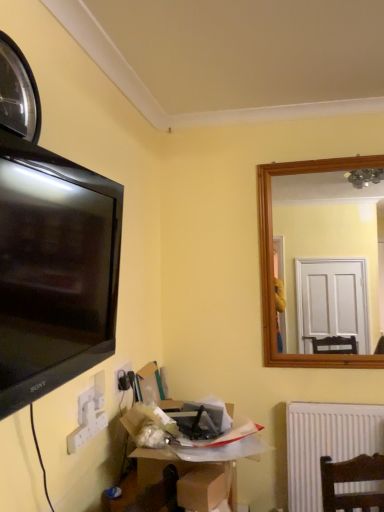
Question: Is metallic reflective clock at upper left looking in the opposite direction of cardboard box at lower center, the second cardboard box from the front?

Choices:
 (A) no
 (B) yes

Answer: (A)

Question: Can you confirm if metallic reflective clock at upper left is bigger than cardboard box at lower center, the second cardboard box from the front?

Choices:
 (A) yes
 (B) no

Answer: (B)

Question: Is metallic reflective clock at upper left taller than cardboard box at lower center, which appears as the 1th cardboard box when viewed from the back?

Choices:
 (A) no
 (B) yes

Answer: (B)

Question: Is metallic reflective clock at upper left facing towards cardboard box at lower center, which appears as the 1th cardboard box when viewed from the back?

Choices:
 (A) yes
 (B) no

Answer: (B)

Question: Is metallic reflective clock at upper left to the left of cardboard box at lower center, the second cardboard box from the front, from the viewer's perspective?

Choices:
 (A) yes
 (B) no

Answer: (A)

Question: From the image's perspective, is metallic reflective clock at upper left beneath cardboard box at lower center, the second cardboard box from the front?

Choices:
 (A) yes
 (B) no

Answer: (B)

Question: Can you confirm if white plastic electric outlet at lower left is bigger than cardboard box at lower center, which appears as the 1th cardboard box when viewed from the back?

Choices:
 (A) yes
 (B) no

Answer: (B)

Question: Is white plastic electric outlet at lower left facing away from cardboard box at lower center, the second cardboard box from the front?

Choices:
 (A) no
 (B) yes

Answer: (A)

Question: From a real-world perspective, is white plastic electric outlet at lower left below cardboard box at lower center, the second cardboard box from the front?

Choices:
 (A) yes
 (B) no

Answer: (B)

Question: From the image's perspective, is white plastic electric outlet at lower left on cardboard box at lower center, the second cardboard box from the front?

Choices:
 (A) yes
 (B) no

Answer: (A)

Question: Is the surface of white plastic electric outlet at lower left in direct contact with cardboard box at lower center, which appears as the 1th cardboard box when viewed from the back?

Choices:
 (A) no
 (B) yes

Answer: (A)

Question: Is cardboard box at lower center, which appears as the 1th cardboard box when viewed from the back, completely or partially inside white plastic electric outlet at lower left?

Choices:
 (A) no
 (B) yes

Answer: (A)

Question: Is brown cardboard box at lower center, which is the second cardboard box in back-to-front order, behind cardboard box at lower center, which appears as the 1th cardboard box when viewed from the back?

Choices:
 (A) yes
 (B) no

Answer: (B)